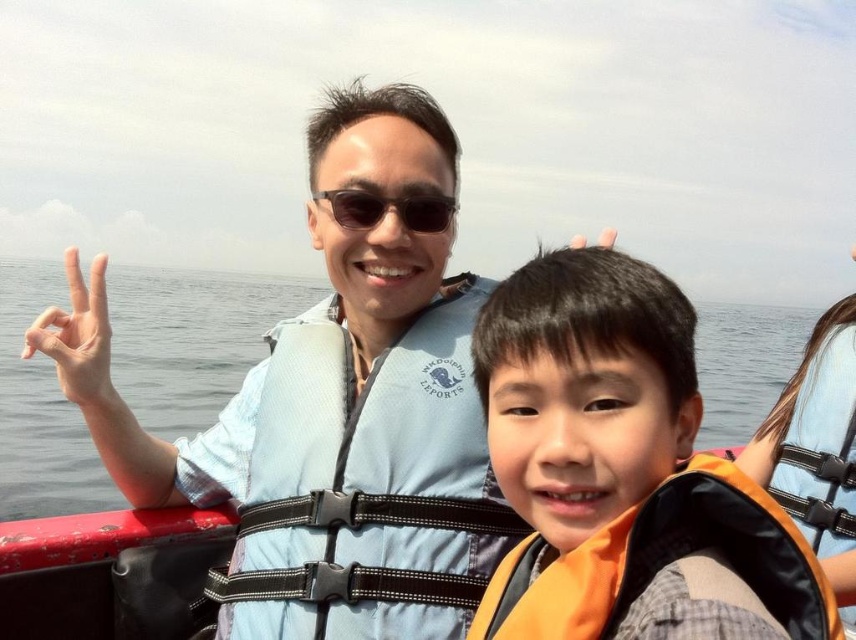
You are a photographer trying to capture the orange life vest at center in the image. Where exactly should you focus your camera to ensure it is in the frame?

You should focus your camera at point 0.669 on the x axis and 0.680 on the y axis to capture the orange life vest at center.

You are on a boat and need to place two buoys at the coordinates point (486,522) and point (100,284). Which buoy will appear larger in the camera view?

Point (486,522) is closer to the viewer than point (100,284), so the buoy placed at point (486,522) will appear larger in the camera view.

You are a photographer trying to capture a photo of the blue mesh life jacket at center and the white matte hand at left. Since you want to focus on the life jacket, which object should you place closer to the camera?

The blue mesh life jacket at center has a lesser width compared to the white matte hand at left, so to focus on the life jacket, you should place it closer to the camera to make it appear larger in the photo.